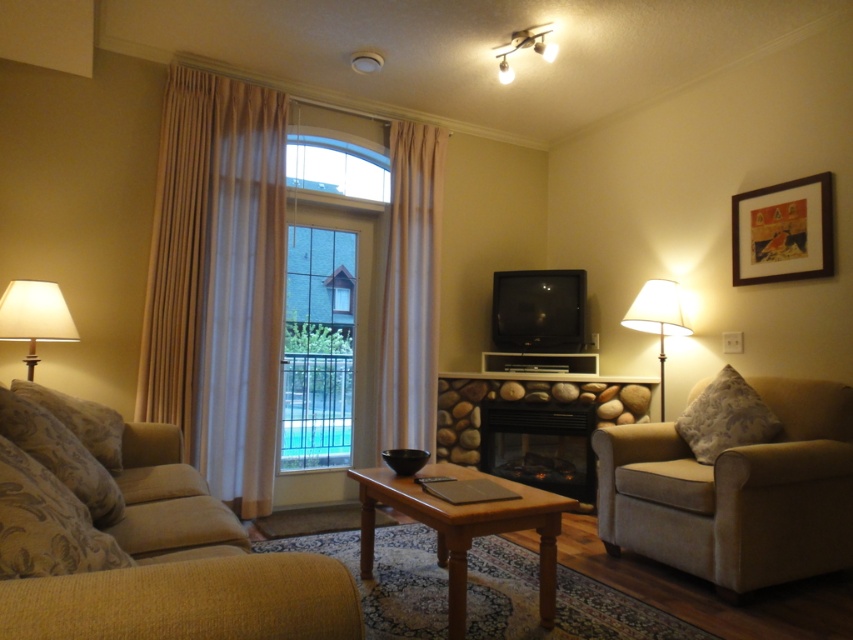
You are sitting on the beige fabric couch at left and want to place a book on the light brown wooden coffee table at center. Is the coffee table within easy reach from the couch?

The beige fabric couch at left is closer to the viewer than the light brown wooden coffee table at center, so the coffee table is farther away. Therefore, it may not be within easy reach from the couch.

You are sitting on the beige fabric couch at left and want to reach the light brown wooden coffee table at center. In which direction should you move to get to the coffee table?

The beige fabric couch at left is to the left of the light brown wooden coffee table at center, so you should move to the right to reach the coffee table.